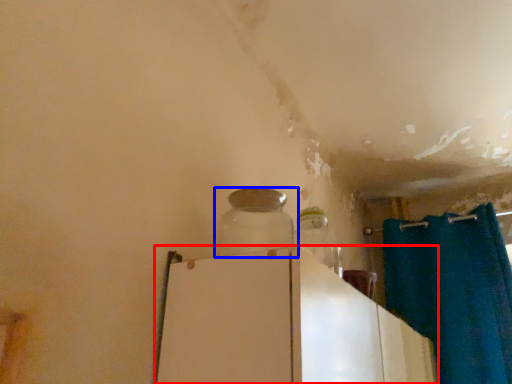
Question: Which of the following is the farthest to the observer, appliance (highlighted by a red box) or bottle (highlighted by a blue box)?

Choices:
 (A) appliance
 (B) bottle

Answer: (B)